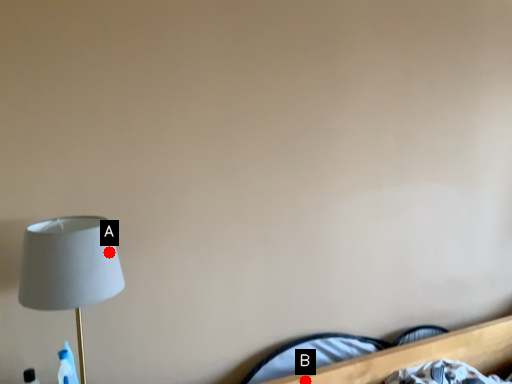
Question: Two points are circled on the image, labeled by A and B beside each circle. Which point is further to the camera?

Choices:
 (A) A is further
 (B) B is further

Answer: (B)